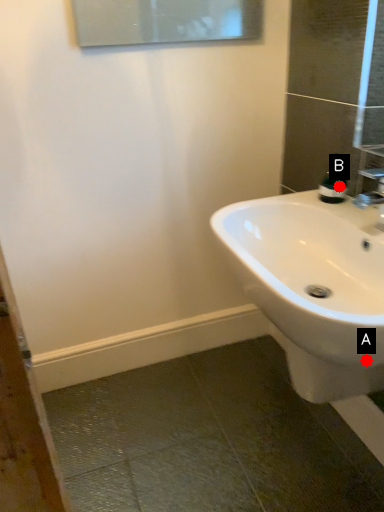
Question: Two points are circled on the image, labeled by A and B beside each circle. Which point appears closest to the camera in this image?

Choices:
 (A) A is closer
 (B) B is closer

Answer: (A)